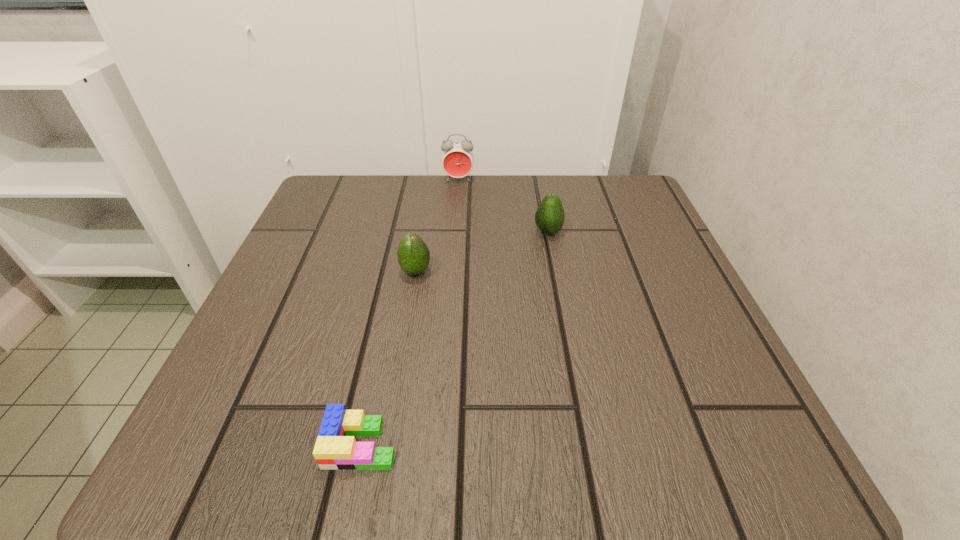
Where is `free spot between the nearer avocado and the second farthest object`? The height and width of the screenshot is (540, 960). free spot between the nearer avocado and the second farthest object is located at coordinates (482, 252).

The image size is (960, 540). Identify the location of unoccupied area between the shortest object and the second nearest object. (389, 358).

This screenshot has width=960, height=540. In order to click on free space between the left avocado and the shortest object in this screenshot , I will do `click(389, 358)`.

This screenshot has width=960, height=540. Identify the location of object that is the third closest to the Lego. (457, 158).

The width and height of the screenshot is (960, 540). What are the coordinates of `object that is the third closest to the farther avocado` in the screenshot? It's located at (336, 448).

Locate an element on the screen. vacant space that satisfies the following two spatial constraints: 1. on the back side of the second farthest object; 2. on the left side of the shortest object is located at coordinates (406, 232).

The height and width of the screenshot is (540, 960). I want to click on free point that satisfies the following two spatial constraints: 1. on the face of the right avocado; 2. on the left side of the farthest object, so click(455, 232).

This screenshot has height=540, width=960. Find the location of `free space that satisfies the following two spatial constraints: 1. on the back side of the nearer avocado; 2. on the right side of the Lego`. free space that satisfies the following two spatial constraints: 1. on the back side of the nearer avocado; 2. on the right side of the Lego is located at coordinates pyautogui.click(x=397, y=272).